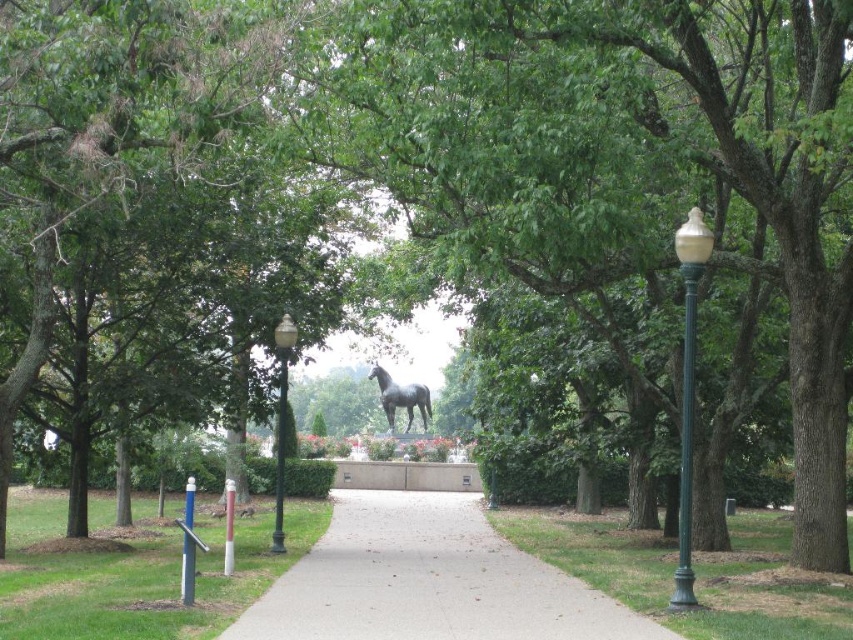
Can you confirm if white glossy lamp post at right is shorter than green matte lamp post at center?

Indeed, white glossy lamp post at right has a lesser height compared to green matte lamp post at center.

What do you see at coordinates (688, 390) in the screenshot? I see `white glossy lamp post at right` at bounding box center [688, 390].

Locate an element on the screen. The width and height of the screenshot is (853, 640). white glossy lamp post at right is located at coordinates (688, 390).

Locate an element on the screen. gray concrete pavement at center is located at coordinates pos(428,580).

Does gray concrete pavement at center appear under shiny black statue at center?

Indeed, gray concrete pavement at center is positioned under shiny black statue at center.

Between point (440, 568) and point (390, 428), which one is positioned in front?

Positioned in front is point (440, 568).

The image size is (853, 640). Identify the location of gray concrete pavement at center. pos(428,580).

Does point (358, 573) come closer to viewer compared to point (190, 576)?

No, (358, 573) is behind (190, 576).

Is point (276, 586) positioned after point (189, 528)?

Yes, it is behind point (189, 528).

Locate an element on the screen. gray concrete pavement at center is located at coordinates (428, 580).